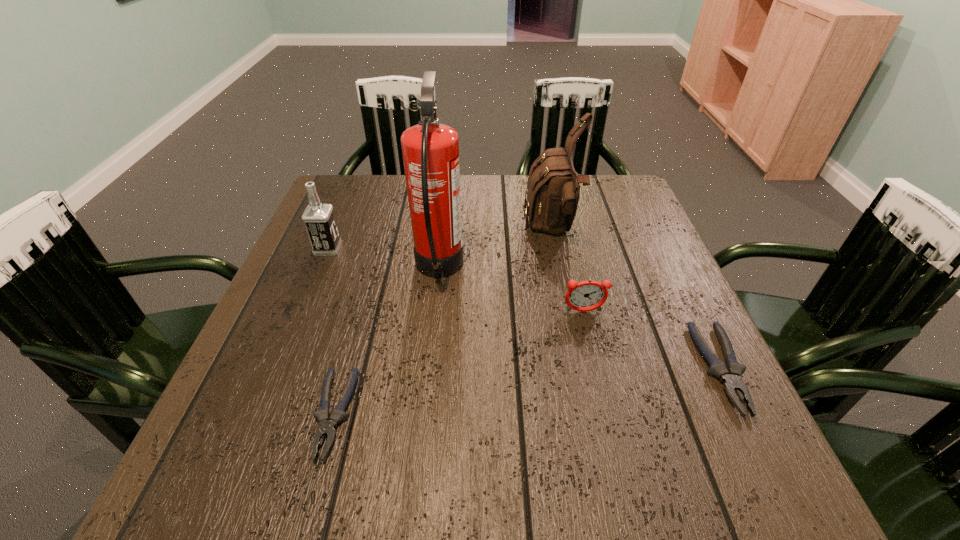
At what (x,y) coordinates should I click in order to perform the action: click on vacant space that is in between the third shortest object and the shorter pliers. Please return your answer as a coordinate pair (x, y). The width and height of the screenshot is (960, 540). Looking at the image, I should click on (459, 362).

This screenshot has width=960, height=540. Find the location of `vacant region between the fourth object from right to left and the fifth shortest object`. vacant region between the fourth object from right to left and the fifth shortest object is located at coordinates (496, 250).

Find the location of a particular element. free space between the tallest object and the second tallest object is located at coordinates (496, 250).

The height and width of the screenshot is (540, 960). I want to click on blank region between the third object from left to right and the fourth tallest object, so click(x=511, y=290).

In order to click on free space between the taller pliers and the fourth farthest object in this screenshot , I will do `click(652, 340)`.

You are a GUI agent. You are given a task and a screenshot of the screen. Output one action in this format:
    pyautogui.click(x=<x>, y=<y>)
    Task: Click on the vacant area that lies between the fifth shortest object and the fifth object from right to left
    This screenshot has width=960, height=540.
    Given the screenshot: What is the action you would take?
    pyautogui.click(x=444, y=322)

Point out which object is positioned as the second nearest to the fourth tallest object. Please provide its 2D coordinates. Your answer should be formatted as a tuple, i.e. [(x, y)], where the tuple contains the x and y coordinates of a point satisfying the conditions above.

[(730, 375)]

Locate which object ranks third in proximity to the fifth shortest object. Please provide its 2D coordinates. Your answer should be formatted as a tuple, i.e. [(x, y)], where the tuple contains the x and y coordinates of a point satisfying the conditions above.

[(730, 375)]

Locate an element on the screen. This screenshot has height=540, width=960. free location that satisfies the following two spatial constraints: 1. on the front-facing side of the second tallest object; 2. at the gripping part of the left pliers is located at coordinates (591, 414).